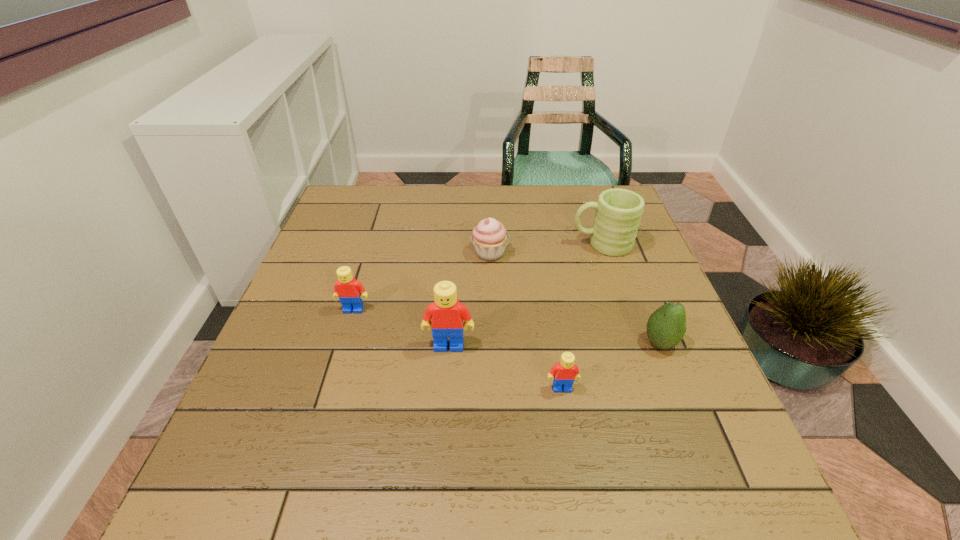
In order to click on free location located 0.110m on the face of the second farthest Lego in this screenshot , I will do `click(445, 399)`.

I want to click on vacant space located on the face of the third object from right to left, so click(x=569, y=431).

Identify the location of vacant space located on the left of the avocado. pos(614,343).

Locate an element on the screen. vacant area situated on the left of the cupcake is located at coordinates (376, 253).

Image resolution: width=960 pixels, height=540 pixels. I want to click on vacant region located on the side of the mug with the handle, so click(x=465, y=244).

Image resolution: width=960 pixels, height=540 pixels. Find the location of `vacant region located on the side of the mug with the handle`. vacant region located on the side of the mug with the handle is located at coordinates (505, 244).

Locate an element on the screen. The image size is (960, 540). free space located on the side of the mug with the handle is located at coordinates (501, 244).

You are a GUI agent. You are given a task and a screenshot of the screen. Output one action in this format:
    pyautogui.click(x=<x>, y=<y>)
    Task: Click on the object that is at the left edge
    The height and width of the screenshot is (540, 960).
    Given the screenshot: What is the action you would take?
    pyautogui.click(x=350, y=291)

Identify the location of avocado that is at the right edge. Image resolution: width=960 pixels, height=540 pixels. (666, 326).

Find the location of a particular element. mug that is at the right edge is located at coordinates click(618, 213).